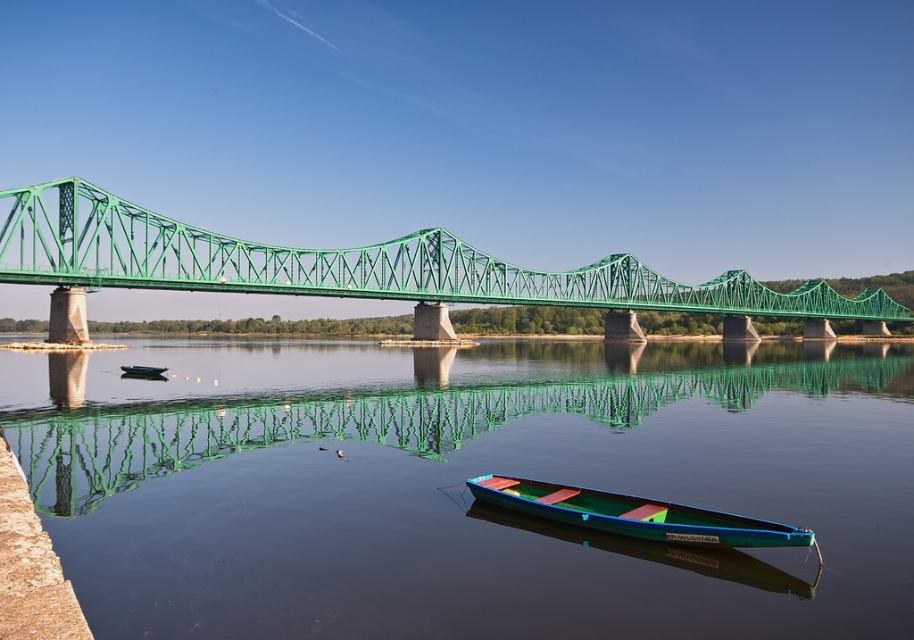
Locate an element on the screen. The width and height of the screenshot is (914, 640). teal glossy canoe at lower center is located at coordinates (634, 515).

Is teal glossy canoe at lower center taller than green plastic boat at center?

Correct, teal glossy canoe at lower center is much taller as green plastic boat at center.

Measure the distance between teal glossy canoe at lower center and camera.

teal glossy canoe at lower center and camera are 33.21 meters apart.

You are a GUI agent. You are given a task and a screenshot of the screen. Output one action in this format:
    pyautogui.click(x=<x>, y=<y>)
    Task: Click on the teal glossy canoe at lower center
    
    Given the screenshot: What is the action you would take?
    pyautogui.click(x=634, y=515)

Can you confirm if green metal bridge at center is wider than green plastic boat at center?

Yes, green metal bridge at center is wider than green plastic boat at center.

Between point (158, 243) and point (156, 376), which one is positioned in front?

Point (156, 376)

The image size is (914, 640). Identify the location of green metal bridge at center. (355, 266).

Is point (133, 218) farther from viewer compared to point (731, 518)?

Yes, it is.

At what (x,y) coordinates should I click in order to perform the action: click on green metal bridge at center. Please return your answer as a coordinate pair (x, y). The image size is (914, 640). Looking at the image, I should click on (355, 266).